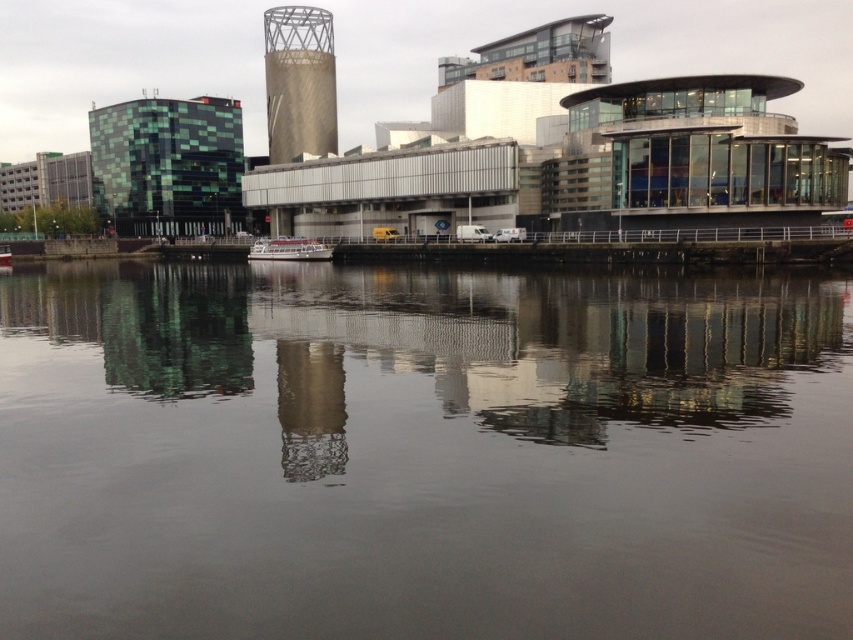
Question: Is transparent water at center to the left of gold textured tower at center from the viewer's perspective?

Choices:
 (A) no
 (B) yes

Answer: (A)

Question: Which of the following is the closest to the observer?

Choices:
 (A) gold textured tower at center
 (B) transparent water at center

Answer: (B)

Question: Is transparent water at center smaller than gold textured tower at center?

Choices:
 (A) no
 (B) yes

Answer: (A)

Question: Is transparent water at center above gold textured tower at center?

Choices:
 (A) no
 (B) yes

Answer: (A)